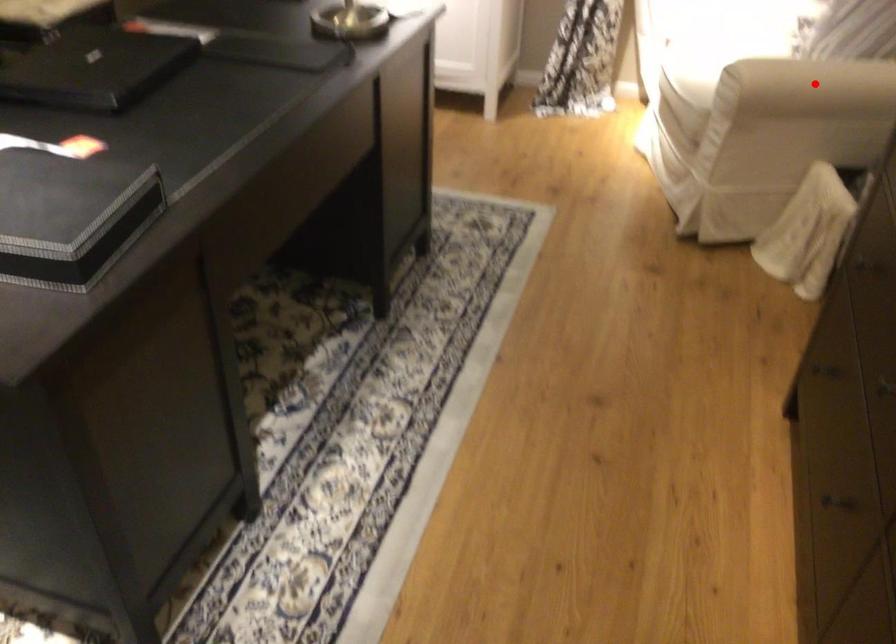
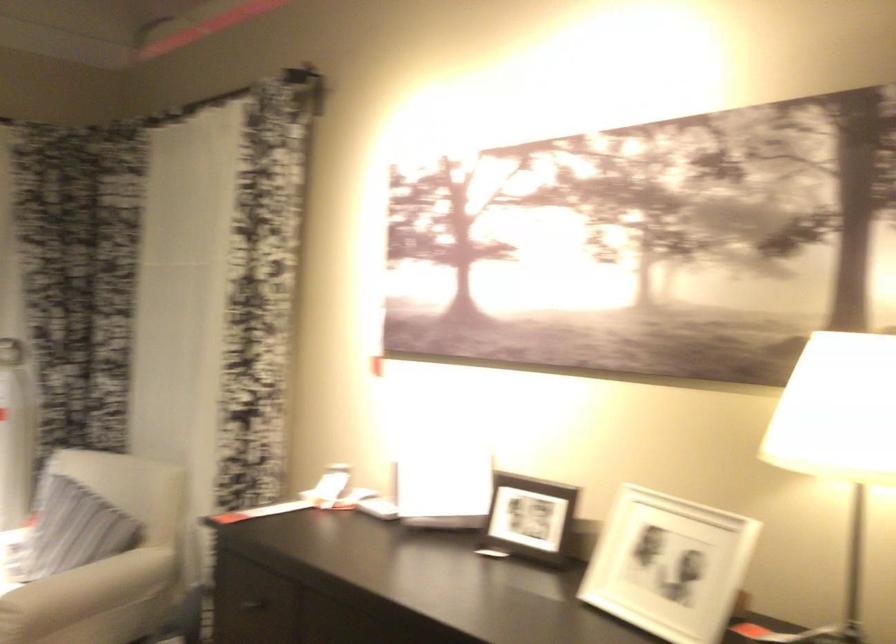
Find the pixel in the second image that matches the highlighted location in the first image.

(85, 592)